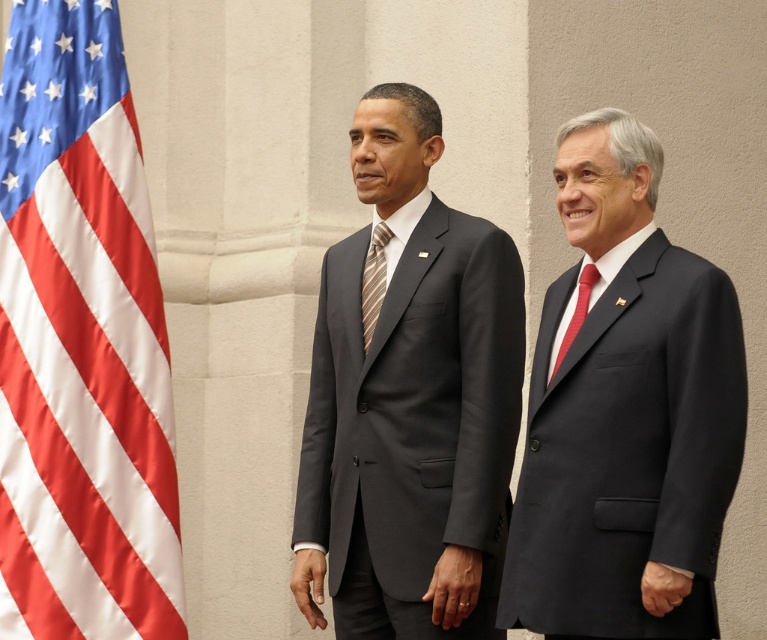
Question: Can you confirm if satin fabric flag at left is positioned above red silk tie at right?

Choices:
 (A) yes
 (B) no

Answer: (A)

Question: Based on their relative distances, which object is farther from the matte black suit at center?

Choices:
 (A) satin fabric flag at left
 (B) matte black suit at right
 (C) red silk tie at right
 (D) striped fabric tie at center

Answer: (A)

Question: Does matte black suit at center lie in front of striped fabric tie at center?

Choices:
 (A) no
 (B) yes

Answer: (B)

Question: Observing the image, what is the correct spatial positioning of matte black suit at center in reference to red silk tie at right?

Choices:
 (A) right
 (B) left

Answer: (B)

Question: Which object is closer to the camera taking this photo?

Choices:
 (A) matte black suit at center
 (B) red silk tie at right

Answer: (A)

Question: Among these objects, which one is farthest from the camera?

Choices:
 (A) matte black suit at center
 (B) striped fabric tie at center
 (C) red silk tie at right
 (D) satin fabric flag at left

Answer: (D)